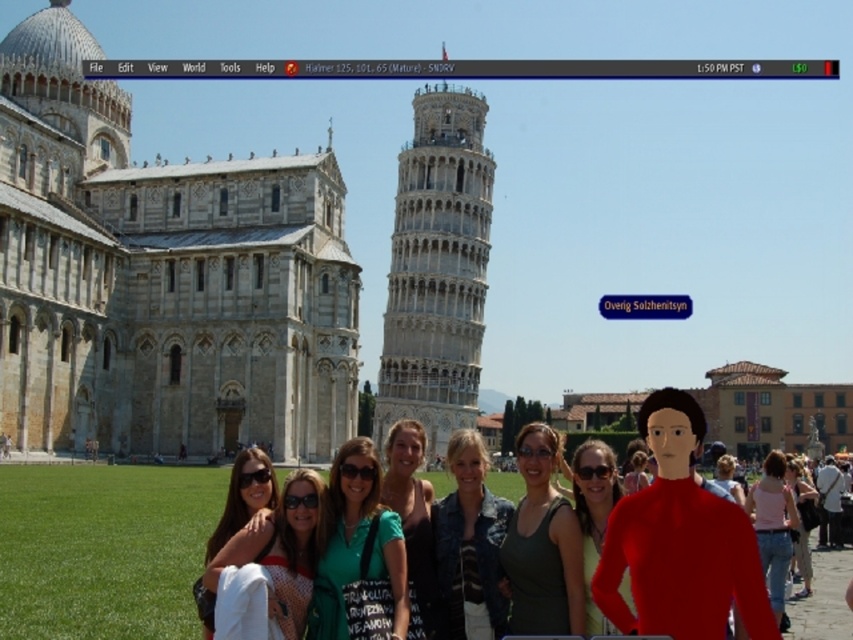
Question: Does matte red shirt at center lie behind denim jeans at lower right?

Choices:
 (A) no
 (B) yes

Answer: (A)

Question: Is denim jacket at center bigger than matte red shirt at center?

Choices:
 (A) no
 (B) yes

Answer: (A)

Question: Which object appears closest to the camera in this image?

Choices:
 (A) green fabric dress at center
 (B) dark green tank top at center
 (C) white stone tower at center
 (D) matte red shirt at center

Answer: (D)

Question: Considering the relative positions of pink fabric top at lower right and denim jeans at lower right in the image provided, where is pink fabric top at lower right located with respect to denim jeans at lower right?

Choices:
 (A) above
 (B) below

Answer: (B)

Question: Which point is farther to the camera?

Choices:
 (A) (807, 564)
 (B) (759, 561)
 (C) (479, 465)
 (D) (456, 170)

Answer: (D)

Question: Among these objects, which one is farthest from the camera?

Choices:
 (A) pink fabric top at lower right
 (B) dark green tank top at center
 (C) denim jacket at center
 (D) matte black sunglasses at lower left

Answer: (C)